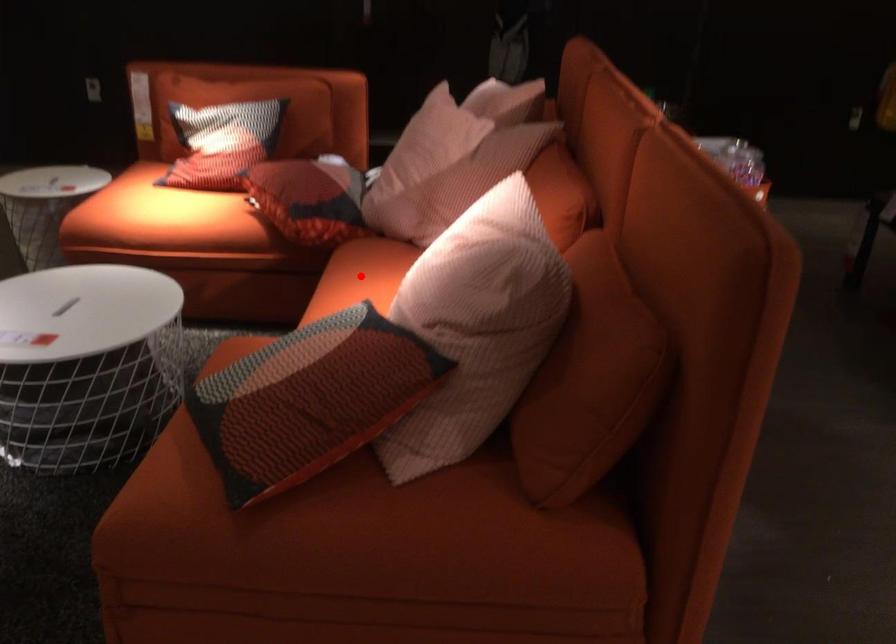
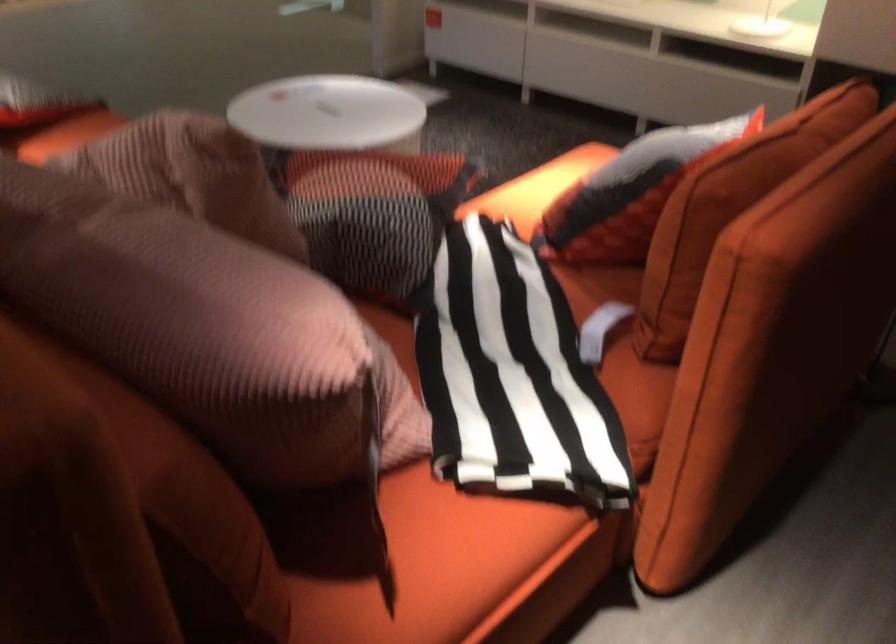
Question: I am providing you with two images of the same scene from different viewpoints. A red point is marked on the first image. At the location where the point appears in image 1, is it still visible in image 2?

Choices:
 (A) Yes
 (B) No

Answer: (B)